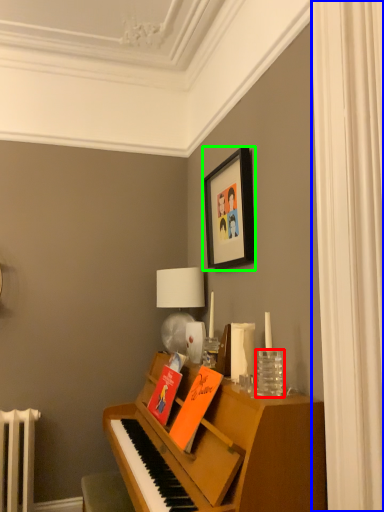
Question: Which object is positioned farthest from glass vase (highlighted by a red box)? Select from curtain (highlighted by a blue box) and picture frame (highlighted by a green box).

Choices:
 (A) curtain
 (B) picture frame

Answer: (B)